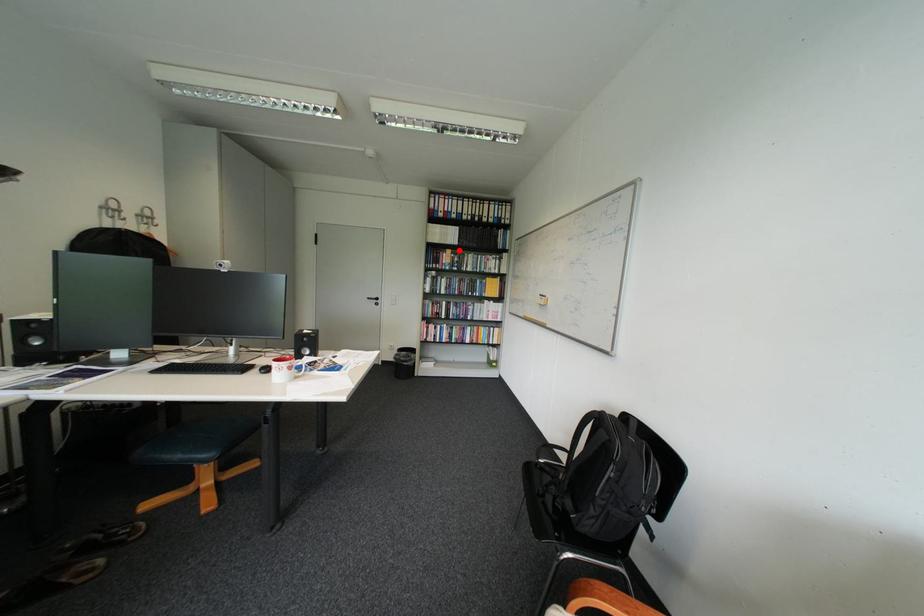
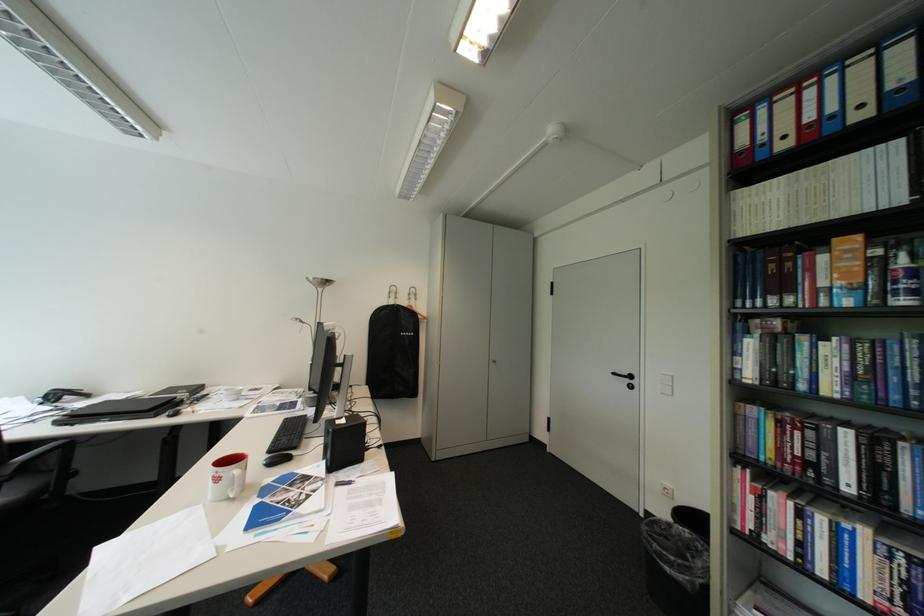
Find the pixel in the second image that matches the highlighted location in the first image.

(848, 240)